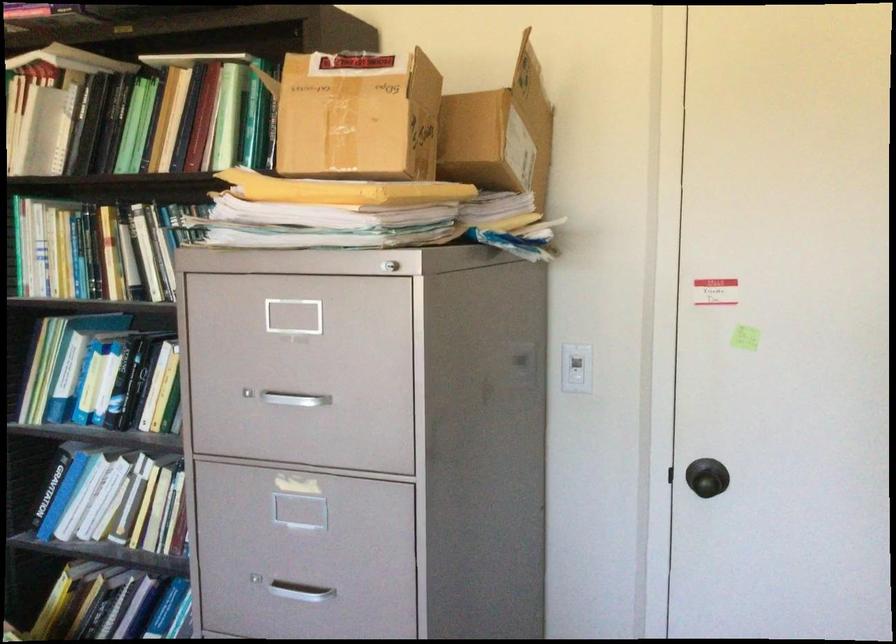
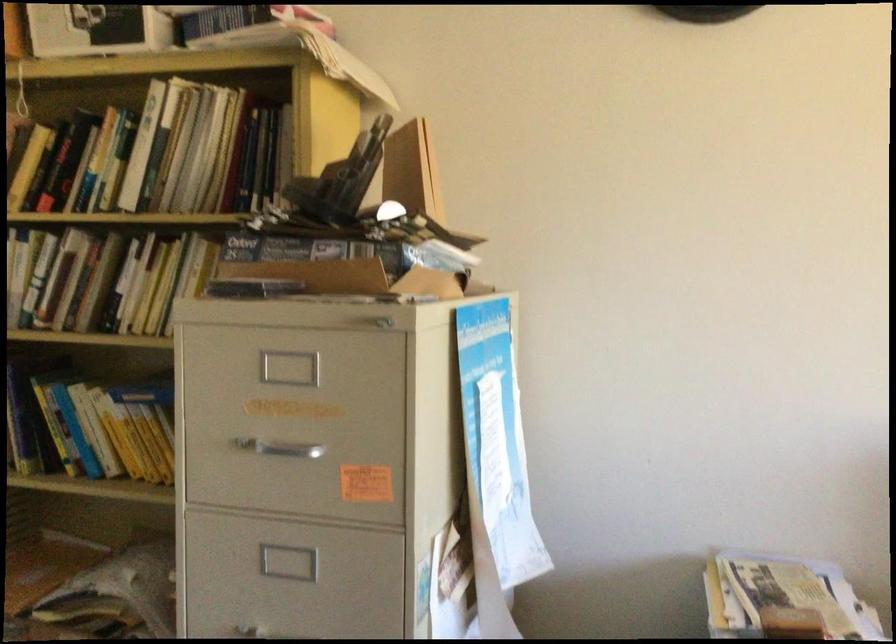
Question: The camera is either moving clockwise (left) or counter-clockwise (right) around the object. The first image is from the beginning of the video and the second image is from the end. Is the camera moving left or right when shooting the video?

Choices:
 (A) Left
 (B) Right

Answer: (A)